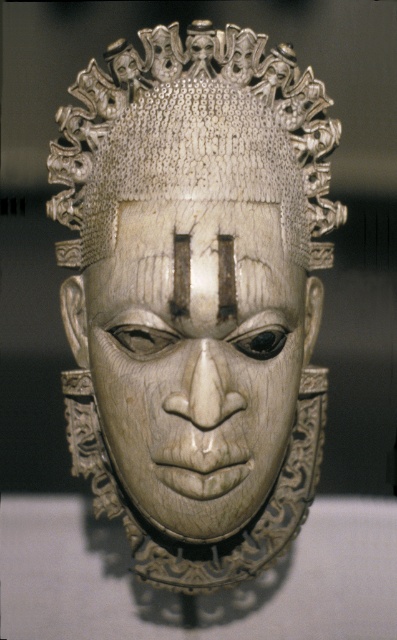
You are an art conservator examining the mask and need to determine the best angle to view the intricate details of both point (181, 426) and point (267, 378). Which point is positioned closer to your line of sight?

Point (181, 426) is closer to the viewer than point (267, 378), so it will be more visible from your current angle.

Looking at this image, you are an art conservator examining two masks displayed side by side. The first is an ivory textured mask at center, and the second is a white carved wood mask at center. Based on their widths, which mask would require a wider display stand to accommodate its dimensions?

The ivory textured mask at center requires a wider display stand because its width surpasses that of the white carved wood mask at center.

Looking at this image, you are an art conservator examining the white carved wood mask at center and the ivory textured headdress at center. Which object would require a larger storage space due to its size?

The white carved wood mask at center is larger in size than the ivory textured headdress at center, so it would require a larger storage space.